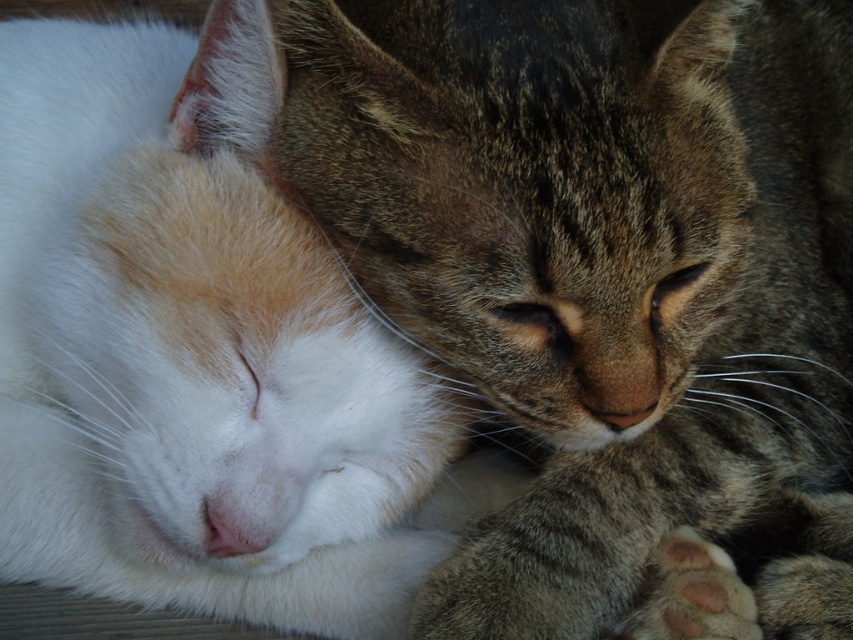
Based on the photo, which of these two, tabby fur paw at center or white soft fur cat at left, stands taller?

white soft fur cat at left

Between point (412, 285) and point (293, 266), which one is positioned behind?

Point (293, 266)

The height and width of the screenshot is (640, 853). What do you see at coordinates (607, 276) in the screenshot? I see `tabby fur paw at center` at bounding box center [607, 276].

Where is `tabby fur paw at center`? The height and width of the screenshot is (640, 853). tabby fur paw at center is located at coordinates (607, 276).

How far apart are tabby fur paw at center and dark gray fur paw at lower right?

They are 28.97 centimeters apart.

Can you confirm if tabby fur paw at center is bigger than dark gray fur paw at lower right?

Yes, tabby fur paw at center is bigger than dark gray fur paw at lower right.

This screenshot has height=640, width=853. What do you see at coordinates (607, 276) in the screenshot?
I see `tabby fur paw at center` at bounding box center [607, 276].

This screenshot has height=640, width=853. In order to click on tabby fur paw at center in this screenshot , I will do `click(607, 276)`.

Who is positioned more to the right, white soft fur cat at left or dark gray fur paw at lower right?

From the viewer's perspective, dark gray fur paw at lower right appears more on the right side.

Measure the distance between white soft fur cat at left and dark gray fur paw at lower right.

20.77 inches

Is point (108, 188) positioned before point (651, 566)?

Yes, it is in front of point (651, 566).

This screenshot has width=853, height=640. What are the coordinates of `white soft fur cat at left` in the screenshot? It's located at [192, 346].